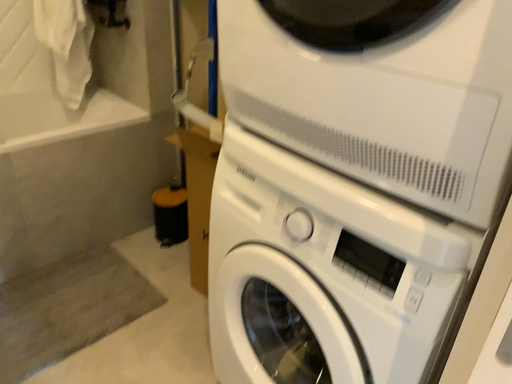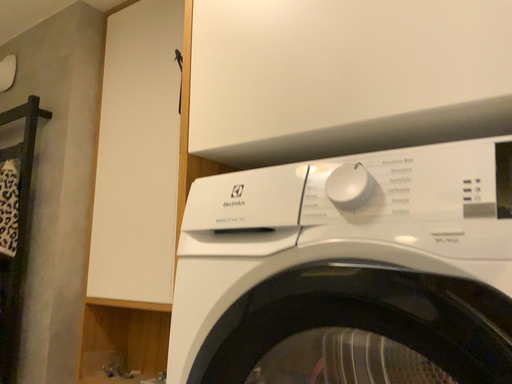
Question: Which way did the camera rotate in the video?

Choices:
 (A) rotated upward
 (B) rotated downward

Answer: (A)